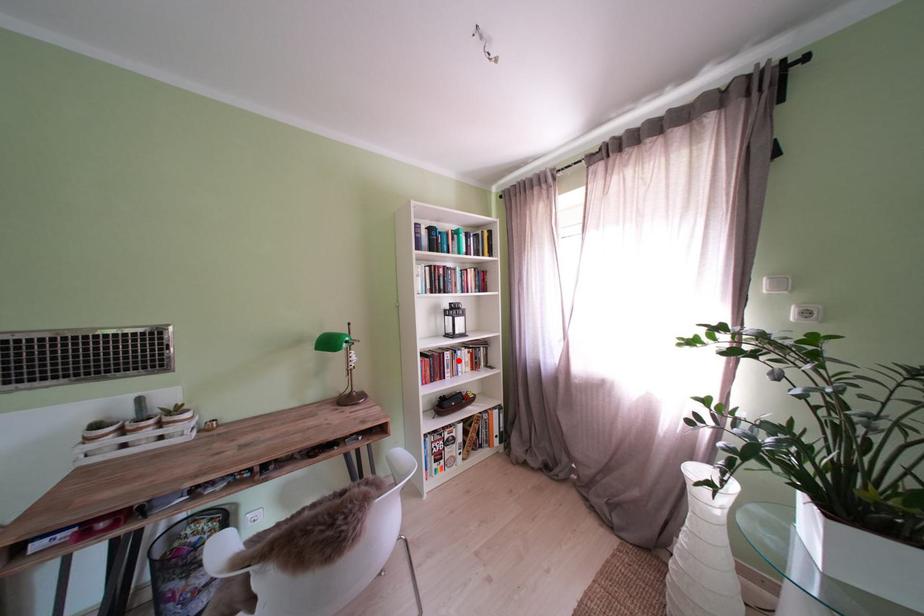
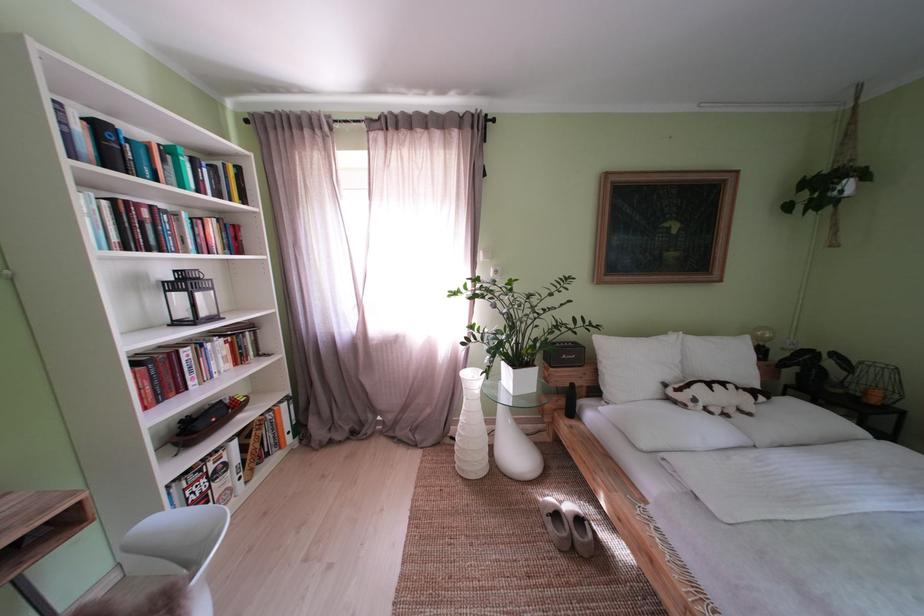
Find the pixel in the second image that matches the highlighted location in the first image.

(199, 359)